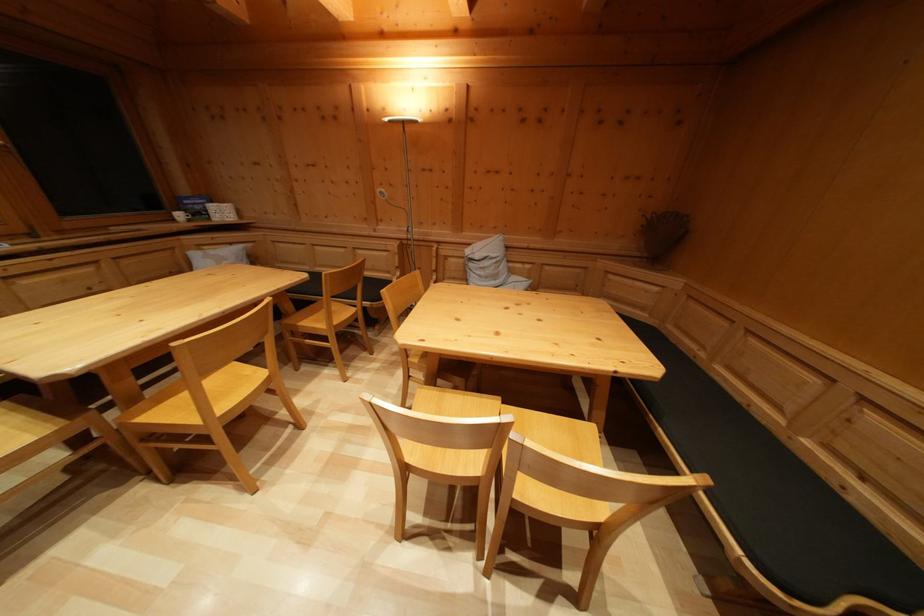
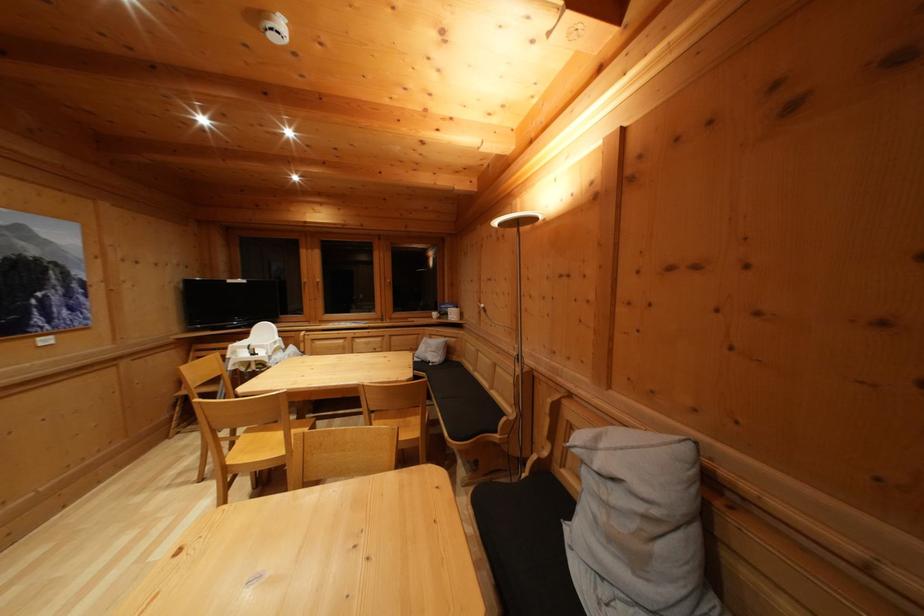
Locate, in the second image, the point that corresponds to (x=193, y=205) in the first image.

(450, 310)